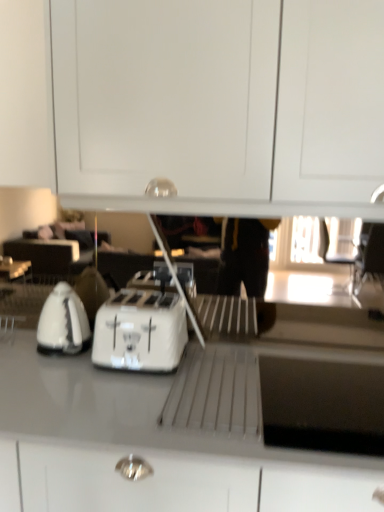
Question: Is white plastic toaster at center spatially inside white glossy cabinet at upper center, or outside of it?

Choices:
 (A) inside
 (B) outside

Answer: (B)

Question: Considering the positions of white plastic toaster at center and white glossy cabinet at upper center in the image, is white plastic toaster at center taller or shorter than white glossy cabinet at upper center?

Choices:
 (A) short
 (B) tall

Answer: (A)

Question: Based on their relative distances, which object is nearer to the white glossy countertop at center?

Choices:
 (A) white glossy kettle at left
 (B) white plastic toaster at center
 (C) white glossy cabinet at upper center

Answer: (B)

Question: Based on their relative distances, which object is farther from the white glossy cabinet at upper center?

Choices:
 (A) white plastic toaster at center
 (B) white glossy kettle at left
 (C) white glossy countertop at center

Answer: (B)